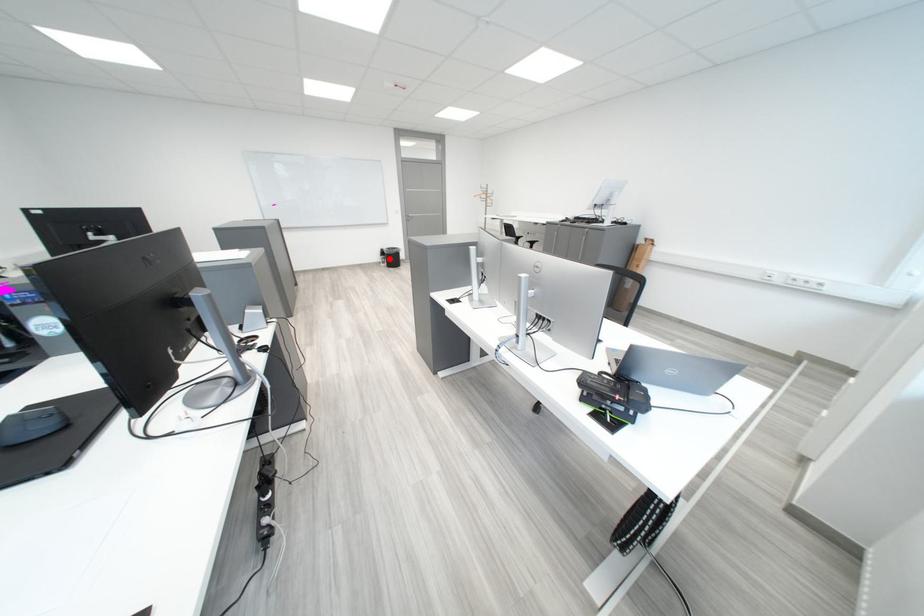
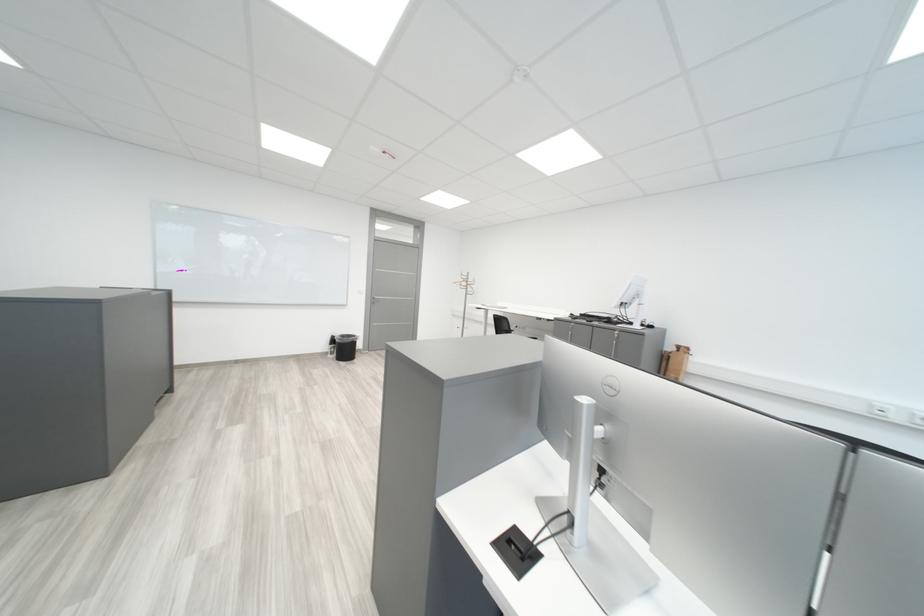
Question: A red point is marked in image1. In image2, is the corresponding 3D point closer to the camera or farther? Reply with the corresponding letter.

Choices:
 (A) The corresponding 3D point is closer.
 (B) The corresponding 3D point is farther.

Answer: (B)